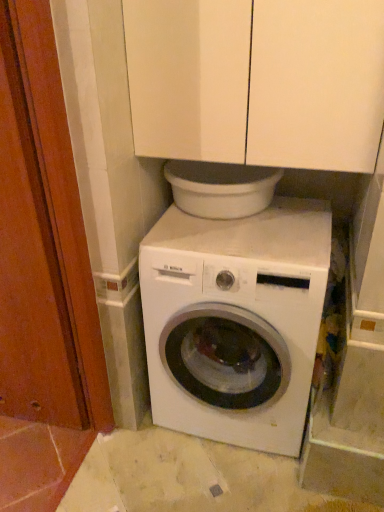
Question: From the image's perspective, is wooden screen door at left below white matte cabinet at upper center?

Choices:
 (A) yes
 (B) no

Answer: (A)

Question: From the image's perspective, is wooden screen door at left on white matte cabinet at upper center?

Choices:
 (A) yes
 (B) no

Answer: (B)

Question: Could you tell me if wooden screen door at left is turned towards white matte cabinet at upper center?

Choices:
 (A) no
 (B) yes

Answer: (A)

Question: Does wooden screen door at left have a greater height compared to white matte cabinet at upper center?

Choices:
 (A) yes
 (B) no

Answer: (A)

Question: Does wooden screen door at left lie behind white matte cabinet at upper center?

Choices:
 (A) yes
 (B) no

Answer: (A)

Question: Is wooden screen door at left in front of or behind white matte cabinet at upper center in the image?

Choices:
 (A) front
 (B) behind

Answer: (B)

Question: Would you say wooden screen door at left is to the left or to the right of white matte cabinet at upper center in the picture?

Choices:
 (A) left
 (B) right

Answer: (A)

Question: Is wooden screen door at left taller or shorter than white matte cabinet at upper center?

Choices:
 (A) tall
 (B) short

Answer: (A)

Question: Is point (56, 399) closer or farther from the camera than point (379, 92)?

Choices:
 (A) closer
 (B) farther

Answer: (B)

Question: From the image's perspective, is wooden screen door at left above or below white glossy washing machine at center?

Choices:
 (A) above
 (B) below

Answer: (A)

Question: From a real-world perspective, is wooden screen door at left above or below white glossy washing machine at center?

Choices:
 (A) below
 (B) above

Answer: (B)

Question: Based on their sizes in the image, would you say wooden screen door at left is bigger or smaller than white glossy washing machine at center?

Choices:
 (A) small
 (B) big

Answer: (A)

Question: Considering the positions of wooden screen door at left and white glossy washing machine at center in the image, is wooden screen door at left taller or shorter than white glossy washing machine at center?

Choices:
 (A) short
 (B) tall

Answer: (B)

Question: From the image's perspective, relative to wooden screen door at left, is white glossy washing machine at center above or below?

Choices:
 (A) below
 (B) above

Answer: (A)

Question: Based on their sizes in the image, would you say white glossy washing machine at center is bigger or smaller than wooden screen door at left?

Choices:
 (A) big
 (B) small

Answer: (A)